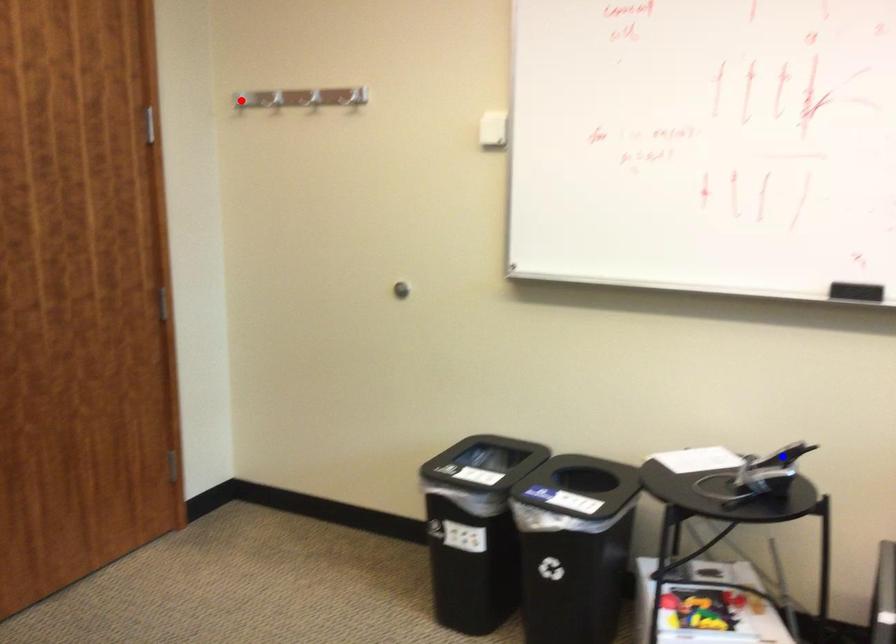
Question: In the image, two points are highlighted. Which point is nearer to the camera? Reply with the corresponding letter.

Choices:
 (A) blue point
 (B) red point

Answer: (A)